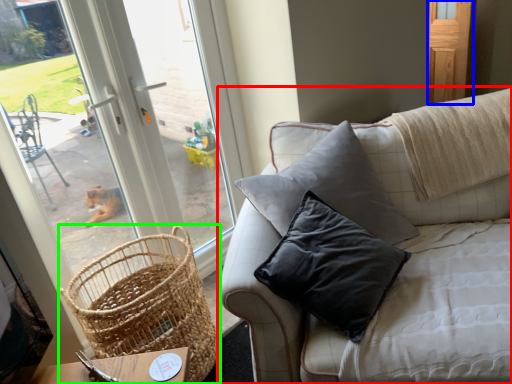
Question: Estimate the real-world distances between objects in this image. Which object is farther from studio couch (highlighted by a red box), screen door (highlighted by a blue box) or picnic basket (highlighted by a green box)?

Choices:
 (A) screen door
 (B) picnic basket

Answer: (A)